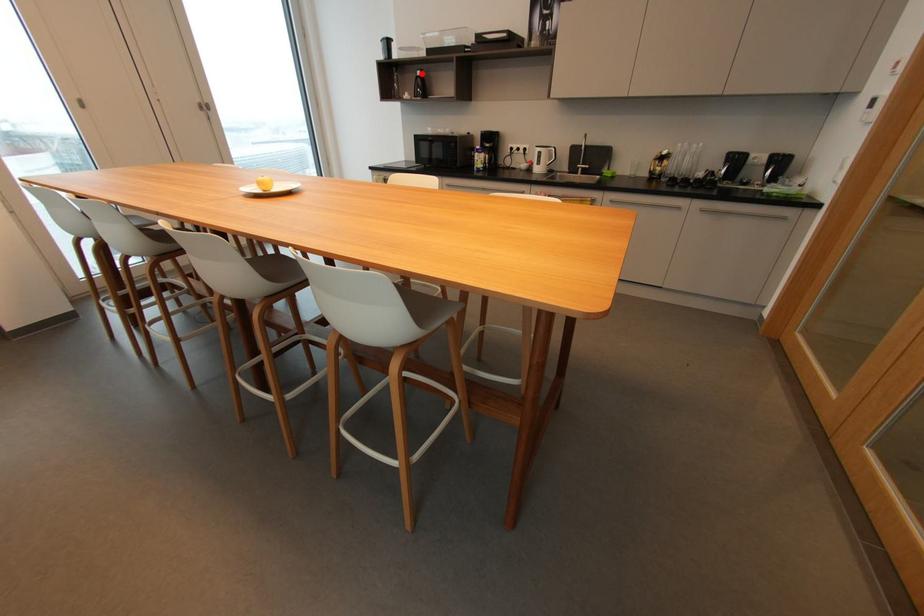
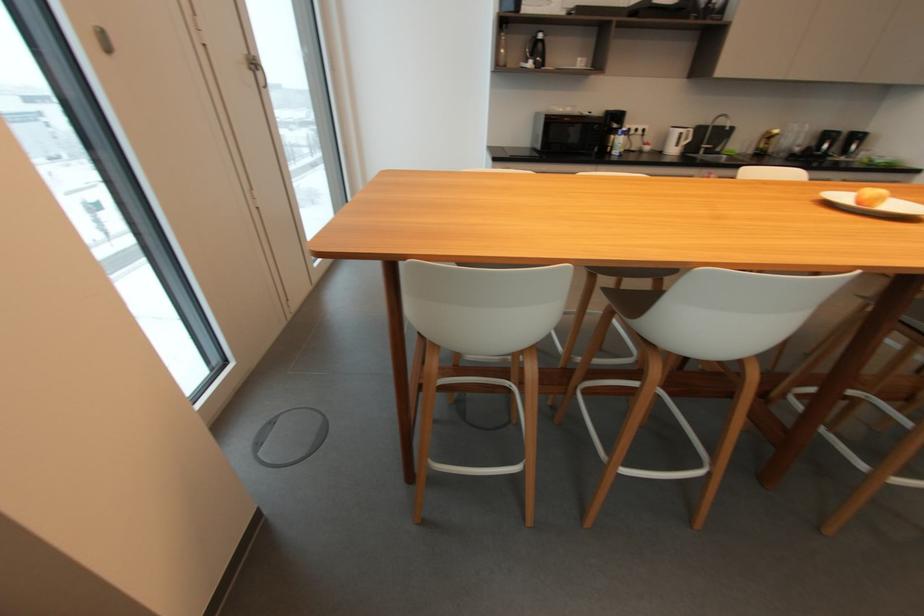
Question: I am providing you with two images of the same scene from different viewpoints. Image1 has a red point marked. In image2, the corresponding 3D location appears at what relative position? Reply with the corresponding letter.

Choices:
 (A) Closer
 (B) Farther

Answer: (B)